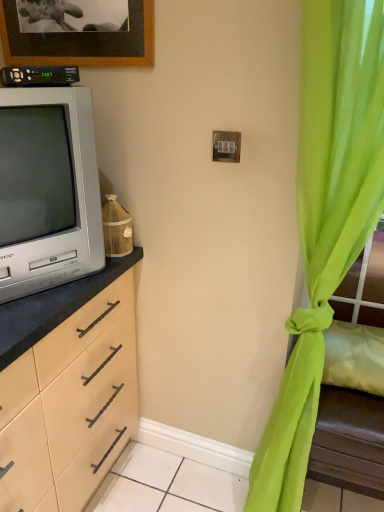
Describe the element at coordinates (226, 146) in the screenshot. I see `white plastic switch at center` at that location.

I want to click on wooden framed picture at upper left, so click(x=77, y=32).

Where is `white plastic switch at center`? white plastic switch at center is located at coordinates (226, 146).

Is wooden framed picture at upper left far from green sheer curtain at right?

Actually, wooden framed picture at upper left and green sheer curtain at right are a little close together.

Based on the photo, which of these two, wooden framed picture at upper left or green sheer curtain at right, is bigger?

Bigger between the two is green sheer curtain at right.

In the scene shown: Is green sheer curtain at right at the back of wooden framed picture at upper left?

No, wooden framed picture at upper left is not facing away from green sheer curtain at right.

Considering the relative positions of wooden framed picture at upper left and green sheer curtain at right in the image provided, is wooden framed picture at upper left behind green sheer curtain at right?

Yes.

Could you tell me if green sheer curtain at right is turned towards white plastic switch at center?

No, green sheer curtain at right is not turned towards white plastic switch at center.

Is point (274, 418) closer to camera compared to point (238, 157)?

No, (274, 418) is further to viewer.

What's the angular difference between green sheer curtain at right and white plastic switch at center's facing directions?

2.52 degrees.

Considering their positions, is green sheer curtain at right located in front of or behind white plastic switch at center?

green sheer curtain at right is in front of white plastic switch at center.

Which object is more forward, white plastic switch at center or matte gray television at left?

matte gray television at left is closer to the camera.

Is white plastic switch at center bigger or smaller than matte gray television at left?

Clearly, white plastic switch at center is smaller in size than matte gray television at left.

How different are the orientations of white plastic switch at center and matte gray television at left in degrees?

60.4 degrees separate the facing orientations of white plastic switch at center and matte gray television at left.

Which of these two, white plastic switch at center or wooden framed picture at upper left, is wider?

wooden framed picture at upper left.

In the image, is white plastic switch at center positioned in front of or behind wooden framed picture at upper left?

white plastic switch at center is positioned farther from the viewer than wooden framed picture at upper left.

Considering the relative positions of white plastic switch at center and wooden framed picture at upper left in the image provided, is white plastic switch at center to the left or to the right of wooden framed picture at upper left?

white plastic switch at center is to the right of wooden framed picture at upper left.

Consider the image. From a real-world perspective, is white plastic switch at center positioned under wooden framed picture at upper left based on gravity?

Indeed, from a real-world perspective, white plastic switch at center is positioned beneath wooden framed picture at upper left.

Is green sheer curtain at right located outside wooden framed picture at upper left?

green sheer curtain at right lies outside wooden framed picture at upper left's area.

Is green sheer curtain at right not near wooden framed picture at upper left?

No, green sheer curtain at right is not far from wooden framed picture at upper left.

Is green sheer curtain at right aimed at wooden framed picture at upper left?

No, green sheer curtain at right is not turned towards wooden framed picture at upper left.

Considering the sizes of objects green sheer curtain at right and wooden framed picture at upper left in the image provided, who is taller, green sheer curtain at right or wooden framed picture at upper left?

With more height is green sheer curtain at right.

Is green sheer curtain at right situated inside matte gray television at left or outside?

green sheer curtain at right is not enclosed by matte gray television at left.

From a real-world perspective, who is located lower, green sheer curtain at right or matte gray television at left?

green sheer curtain at right, from a real-world perspective.

From the picture: Can you confirm if green sheer curtain at right is smaller than matte gray television at left?

No, green sheer curtain at right is not smaller than matte gray television at left.

Is green sheer curtain at right positioned far away from matte gray television at left?

No, green sheer curtain at right is not far away from matte gray television at left.

Considering the points (67, 176) and (227, 156), which point is in front, point (67, 176) or point (227, 156)?

Point (67, 176)

Where is `electric outlet on the right of the matte gray television at left`? This screenshot has height=512, width=384. electric outlet on the right of the matte gray television at left is located at coordinates (226, 146).

Is matte gray television at left positioned with its back to white plastic switch at center?

No, matte gray television at left is not facing the opposite direction of white plastic switch at center.

Where is `picture frame above the green sheer curtain at right (from a real-world perspective)`? The image size is (384, 512). picture frame above the green sheer curtain at right (from a real-world perspective) is located at coordinates (77, 32).

I want to click on electric outlet located on the left of green sheer curtain at right, so click(226, 146).

Looking at the image, which one is located closer to green sheer curtain at right, matte gray television at left or black plastic remote control at upper left?

Among the two, matte gray television at left is located nearer to green sheer curtain at right.

Which object lies further to the anchor point wooden framed picture at upper left, matte gray television at left or green sheer curtain at right?

green sheer curtain at right is positioned further to the anchor wooden framed picture at upper left.

Looking at the image, which one is located further to black plastic remote control at upper left, matte gray television at left or wooden framed picture at upper left?

matte gray television at left is positioned further to the anchor black plastic remote control at upper left.

From the image, which object appears to be nearer to green sheer curtain at right, matte gray television at left or white plastic switch at center?

white plastic switch at center lies closer to green sheer curtain at right than the other object.

Looking at this image, looking at the image, which one is located closer to black plastic remote control at upper left, white plastic switch at center or green sheer curtain at right?

The object closer to black plastic remote control at upper left is white plastic switch at center.

When comparing their distances from white plastic switch at center, does wooden framed picture at upper left or black plastic remote control at upper left seem further?

wooden framed picture at upper left is further to white plastic switch at center.

Estimate the real-world distances between objects in this image. Which object is further from green sheer curtain at right, black plastic remote control at upper left or matte gray television at left?

black plastic remote control at upper left is positioned further to the anchor green sheer curtain at right.

Looking at this image, looking at the image, which one is located closer to matte gray television at left, black plastic remote control at upper left or green sheer curtain at right?

black plastic remote control at upper left is closer to matte gray television at left.

This screenshot has width=384, height=512. What are the coordinates of `picture frame located between black plastic remote control at upper left and white plastic switch at center in the left-right direction` in the screenshot? It's located at (77, 32).

Identify the location of picture frame between matte gray television at left and white plastic switch at center in the horizontal direction. This screenshot has width=384, height=512. (77, 32).

Find the location of a particular element. The width and height of the screenshot is (384, 512). picture frame between matte gray television at left and green sheer curtain at right is located at coordinates (77, 32).

Identify the location of electric outlet between matte gray television at left and green sheer curtain at right from left to right. This screenshot has width=384, height=512. (226, 146).